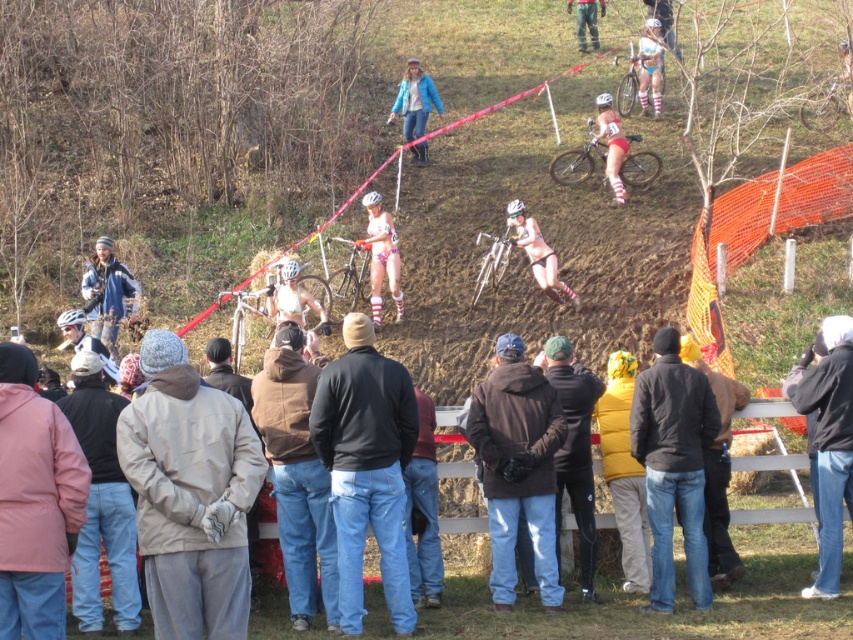
You are a photographer at the cyclocross race and want to capture both the dark brown leather jacket at center and the denim jacket at center in a single frame. Which jacket should you position your camera to the right of to ensure both are in the shot?

You should position your camera to the right of the dark brown leather jacket at center. Since the dark brown leather jacket at center is to the left of the denim jacket at center, placing the camera to the right of the dark brown leather jacket at center will allow both jackets to be captured in the frame.

From the picture: You are a photographer at the cyclocross race and need to capture a wide shot of the light gray jacket at lower left and the matte black helmet at left. Given their widths, which object should you frame closer to the camera to ensure both are fully visible in the photo?

The light gray jacket at lower left has a greater width than the matte black helmet at left. To ensure both are fully visible, you should frame the light gray jacket at lower left closer to the camera since wider objects need to be nearer to maintain visibility in the frame.

You are a photographer standing behind the wooden fence at the event. You want to take a photo of both the dark brown leather jacket at center and the denim jacket at center in the same frame. The camera you have can capture a maximum width of 1.2 meters. Do you think you can fit both jackets in the frame?

The distance between the dark brown leather jacket at center and the denim jacket at center is 1.11 meters, which is less than the camera frame width of 1.2 meters. Therefore, both jackets can be captured in the same frame.